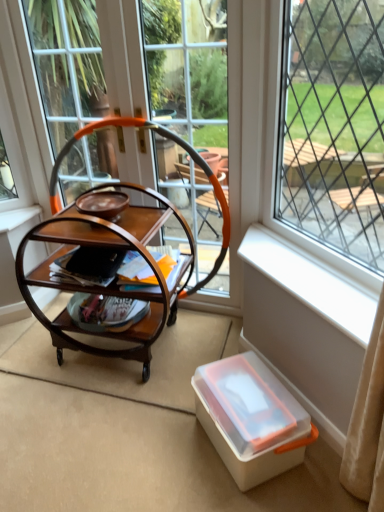
Question: In the image, is wooden/marble-like rocking chair at center on the left side or the right side of clear glass window at center, which is counted as the 2th window, starting from the right?

Choices:
 (A) right
 (B) left

Answer: (B)

Question: From a real-world perspective, is wooden/marble-like rocking chair at center positioned above or below clear glass window at center, which appears as the first window when viewed from the left?

Choices:
 (A) below
 (B) above

Answer: (A)

Question: Estimate the real-world distances between objects in this image. Which object is farther from the wooden/marble-like rocking chair at center?

Choices:
 (A) matte brown plate at center
 (B) wooden trolley at center
 (C) clear glass window at center, which appears as the first window when viewed from the left
 (D) matte brown magazine at center
 (E) transparent plastic window at center, the 2th window in the left-to-right sequence

Answer: (E)

Question: Estimate the real-world distances between objects in this image. Which object is farther from the clear glass window at center, which appears as the first window when viewed from the left?

Choices:
 (A) wooden trolley at center
 (B) transparent plastic window at center, the 2th window in the left-to-right sequence
 (C) matte brown plate at center
 (D) matte brown magazine at center
 (E) white plastic window sill at lower right

Answer: (B)